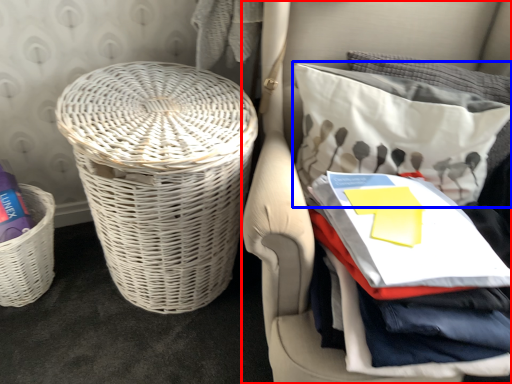
Question: Which object is further to the camera taking this photo, furniture (highlighted by a red box) or pillow (highlighted by a blue box)?

Choices:
 (A) furniture
 (B) pillow

Answer: (B)